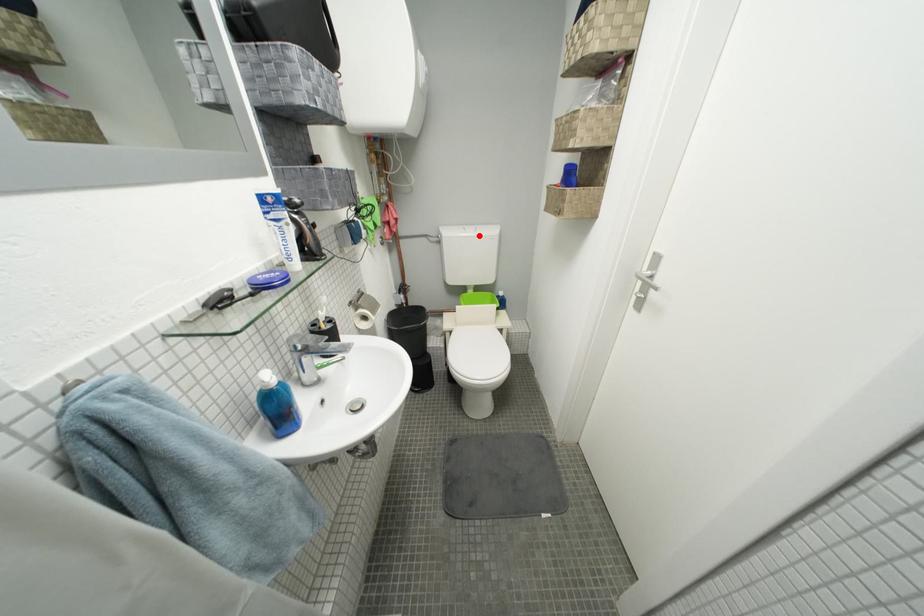
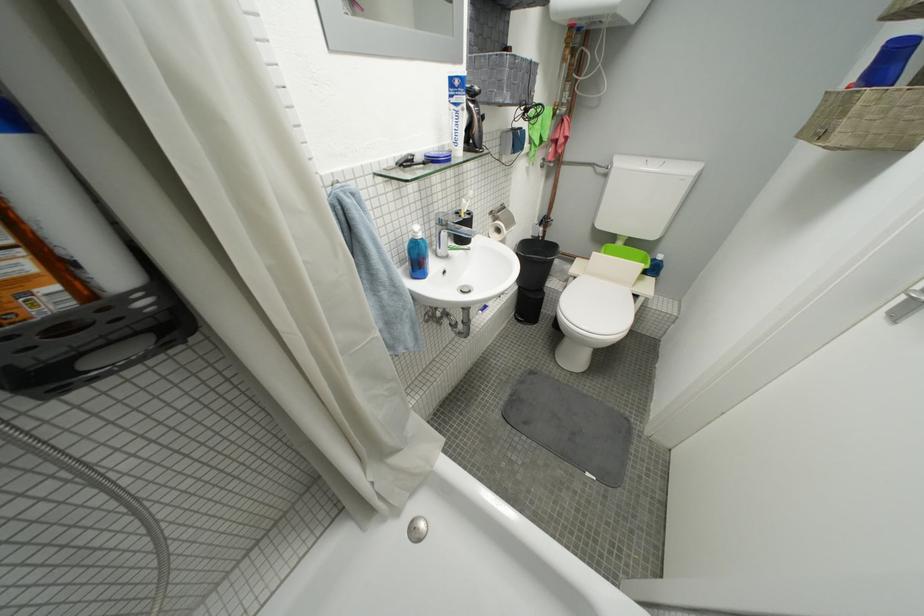
In the second image, find the point that corresponds to the highlighted location in the first image.

(662, 169)